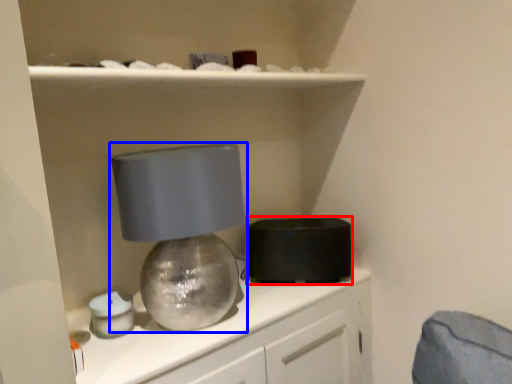
Question: Which object appears closest to the camera in this image, appliance (highlighted by a red box) or lamp (highlighted by a blue box)?

Choices:
 (A) appliance
 (B) lamp

Answer: (B)